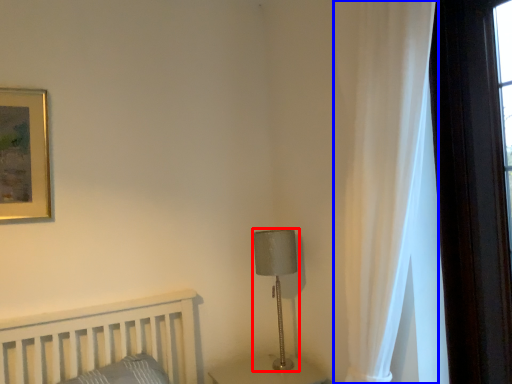
Question: Which of the following is the closest to the observer, table lamp (highlighted by a red box) or curtain (highlighted by a blue box)?

Choices:
 (A) table lamp
 (B) curtain

Answer: (B)